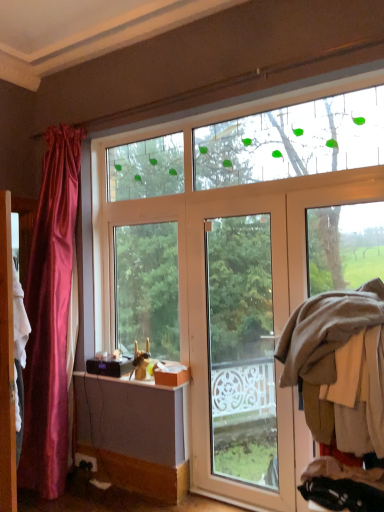
Question: Considering the relative sizes of wooden screen door at left and brown woolen sweater at right in the image provided, is wooden screen door at left taller than brown woolen sweater at right?

Choices:
 (A) yes
 (B) no

Answer: (A)

Question: Does wooden screen door at left appear on the right side of brown woolen sweater at right?

Choices:
 (A) no
 (B) yes

Answer: (A)

Question: Is wooden screen door at left facing away from brown woolen sweater at right?

Choices:
 (A) no
 (B) yes

Answer: (A)

Question: From a real-world perspective, is wooden screen door at left over brown woolen sweater at right?

Choices:
 (A) no
 (B) yes

Answer: (A)

Question: Are wooden screen door at left and brown woolen sweater at right far apart?

Choices:
 (A) yes
 (B) no

Answer: (A)

Question: Is white glossy door at center inside or outside of brown woolen sweater at right?

Choices:
 (A) inside
 (B) outside

Answer: (B)

Question: Considering their positions, is white glossy door at center located in front of or behind brown woolen sweater at right?

Choices:
 (A) front
 (B) behind

Answer: (B)

Question: Considering the positions of white glossy door at center and brown woolen sweater at right in the image, is white glossy door at center wider or thinner than brown woolen sweater at right?

Choices:
 (A) wide
 (B) thin

Answer: (B)

Question: From their relative heights in the image, would you say white glossy door at center is taller or shorter than brown woolen sweater at right?

Choices:
 (A) short
 (B) tall

Answer: (B)

Question: From the image's perspective, is white glossy door at center above or below wooden screen door at left?

Choices:
 (A) above
 (B) below

Answer: (B)

Question: Would you say white glossy door at center is to the left or to the right of wooden screen door at left in the picture?

Choices:
 (A) left
 (B) right

Answer: (B)

Question: In terms of width, does white glossy door at center look wider or thinner when compared to wooden screen door at left?

Choices:
 (A) thin
 (B) wide

Answer: (A)

Question: Is white glossy door at center in front of or behind wooden screen door at left in the image?

Choices:
 (A) front
 (B) behind

Answer: (B)

Question: Looking at their shapes, would you say brown woolen sweater at right is wider or thinner than white glossy door at center?

Choices:
 (A) thin
 (B) wide

Answer: (B)

Question: Is brown woolen sweater at right bigger or smaller than white glossy door at center?

Choices:
 (A) big
 (B) small

Answer: (A)